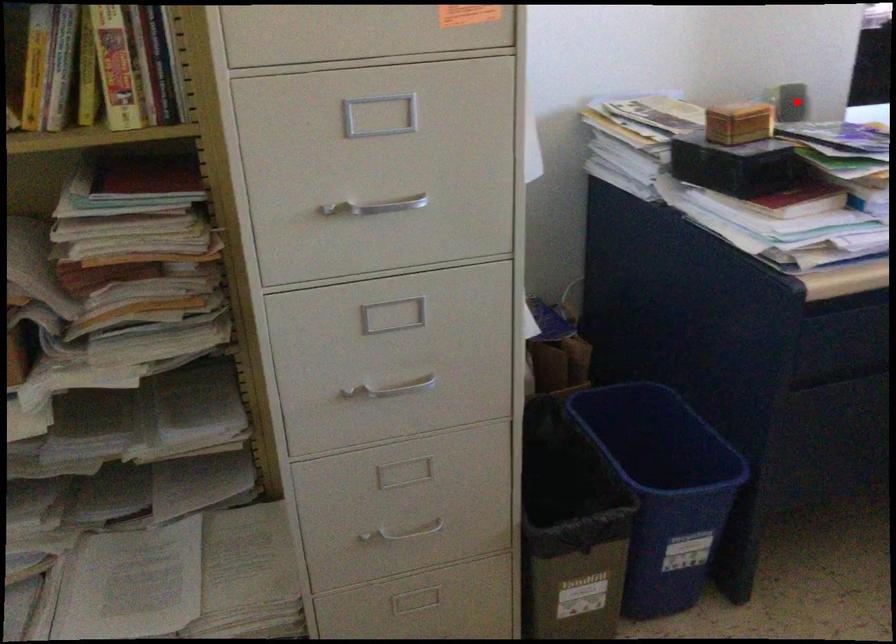
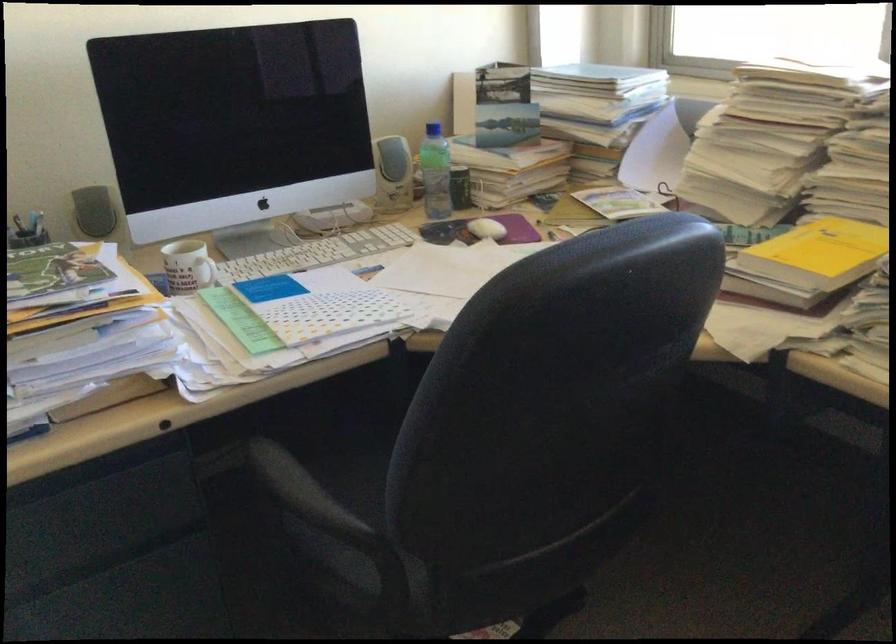
Locate, in the second image, the point that corresponds to the highlighted location in the first image.

(93, 211)